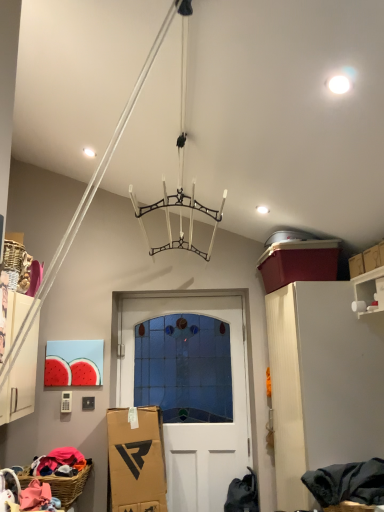
Locate an element on the screen. Image resolution: width=384 pixels, height=512 pixels. dark gray fabric at lower right is located at coordinates (347, 483).

This screenshot has height=512, width=384. Find the location of `white glossy shelf at upper right`. white glossy shelf at upper right is located at coordinates (370, 288).

Is the position of woven brown basket at lower left more distant than that of white glass door at center?

No, it is in front of white glass door at center.

Where is `basket below the white glass door at center (from a real-world perspective)`? basket below the white glass door at center (from a real-world perspective) is located at coordinates (60, 484).

Which of these two, woven brown basket at lower left or white glass door at center, stands taller?

white glass door at center.

Does woven brown basket at lower left have a lesser width compared to white glass door at center?

Incorrect, the width of woven brown basket at lower left is not less than that of white glass door at center.

Considering the sizes of white glossy shelf at upper right and white matte cabinet at right in the image, is white glossy shelf at upper right wider or thinner than white matte cabinet at right?

Considering their sizes, white glossy shelf at upper right looks slimmer than white matte cabinet at right.

Considering the points (377, 308) and (297, 356), which point is behind, point (377, 308) or point (297, 356)?

The point (297, 356) is behind.

From the picture: From a real-world perspective, between white glossy shelf at upper right and white matte cabinet at right, who is vertically higher?

From a 3D spatial view, white glossy shelf at upper right is above.

Is white glossy shelf at upper right at the left side of white matte cabinet at right?

No, white glossy shelf at upper right is not to the left of white matte cabinet at right.

Locate an element on the screen. cabinetry behind the dark gray fabric at lower right is located at coordinates (322, 383).

Is white matte cabinet at right bigger or smaller than dark gray fabric at lower right?

Considering their sizes, white matte cabinet at right takes up more space than dark gray fabric at lower right.

Is white matte cabinet at right inside or outside of dark gray fabric at lower right?

The correct answer is: outside.

Are white glass door at center and dark gray fabric at lower right located far from each other?

Indeed, white glass door at center is not near dark gray fabric at lower right.

Measure the distance from white glass door at center to dark gray fabric at lower right.

white glass door at center and dark gray fabric at lower right are 1.28 meters apart.

Is point (158, 306) more distant than point (383, 465)?

That is True.

Can you confirm if white glass door at center is wider than dark gray fabric at lower right?

Incorrect, the width of white glass door at center does not surpass that of dark gray fabric at lower right.

From a real-world perspective, is white glass door at center located higher than woven brown basket at lower left?

Yes.

Can you confirm if white glass door at center is shorter than woven brown basket at lower left?

No, white glass door at center is not shorter than woven brown basket at lower left.

Considering their positions, is white glass door at center located in front of or behind woven brown basket at lower left?

Visually, white glass door at center is located behind woven brown basket at lower left.

This screenshot has height=512, width=384. Find the location of `door below the white matte cabinet at right (from the image's perspective)`. door below the white matte cabinet at right (from the image's perspective) is located at coordinates click(192, 391).

Is white matte cabinet at right to the left of white glass door at center from the viewer's perspective?

In fact, white matte cabinet at right is to the right of white glass door at center.

Based on the photo, would you say white matte cabinet at right is a long distance from white glass door at center?

white matte cabinet at right is near white glass door at center, not far away.

Is white matte cabinet at right not inside white glass door at center?

That's correct, white matte cabinet at right is outside of white glass door at center.

Is white matte cabinet at right located within woven brown basket at lower left?

No, white matte cabinet at right is not a part of woven brown basket at lower left.

Could you tell me if woven brown basket at lower left is facing white matte cabinet at right?

Yes, woven brown basket at lower left is aimed at white matte cabinet at right.

In the scene shown: Would you say woven brown basket at lower left is to the left or to the right of white matte cabinet at right in the picture?

From the image, it's evident that woven brown basket at lower left is to the left of white matte cabinet at right.

Is woven brown basket at lower left not close to white matte cabinet at right?

woven brown basket at lower left is far away from white matte cabinet at right.

Image resolution: width=384 pixels, height=512 pixels. I want to click on door that is above the woven brown basket at lower left (from the image's perspective), so click(192, 391).

Where is `shelf in front of the white matte cabinet at right`? shelf in front of the white matte cabinet at right is located at coordinates (370, 288).

Estimate the real-world distances between objects in this image. Which object is closer to woven brown basket at lower left, dark gray fabric at lower right or white glossy shelf at upper right?

Among the two, dark gray fabric at lower right is located nearer to woven brown basket at lower left.

Estimate the real-world distances between objects in this image. Which object is closer to white matte cabinet at right, white glass door at center or dark gray fabric at lower right?

dark gray fabric at lower right.

Based on their spatial positions, is white matte cabinet at right or white glossy shelf at upper right closer to dark gray fabric at lower right?

Based on the image, white matte cabinet at right appears to be nearer to dark gray fabric at lower right.

From the image, which object appears to be nearer to white glossy shelf at upper right, white glass door at center or white matte cabinet at right?

white matte cabinet at right lies closer to white glossy shelf at upper right than the other object.

Considering their positions, is white glass door at center positioned further to woven brown basket at lower left than dark gray fabric at lower right?

The object further to woven brown basket at lower left is dark gray fabric at lower right.

Based on their spatial positions, is woven brown basket at lower left or white glass door at center further from white glossy shelf at upper right?

woven brown basket at lower left is further to white glossy shelf at upper right.

From the image, which object appears to be farther from dark gray fabric at lower right, white glass door at center or white matte cabinet at right?

white glass door at center lies further to dark gray fabric at lower right than the other object.

Considering their positions, is white glossy shelf at upper right positioned further to white matte cabinet at right than woven brown basket at lower left?

The object further to white matte cabinet at right is woven brown basket at lower left.

The image size is (384, 512). I want to click on clothing located between woven brown basket at lower left and white glossy shelf at upper right in the left-right direction, so click(x=347, y=483).

Where is `door between woven brown basket at lower left and white matte cabinet at right from left to right`? This screenshot has width=384, height=512. door between woven brown basket at lower left and white matte cabinet at right from left to right is located at coordinates (192, 391).

What are the coordinates of `cabinetry positioned between white glossy shelf at upper right and white glass door at center from near to far` in the screenshot? It's located at (x=322, y=383).

Identify the location of shelf positioned between dark gray fabric at lower right and white glass door at center from near to far. The width and height of the screenshot is (384, 512). (370, 288).